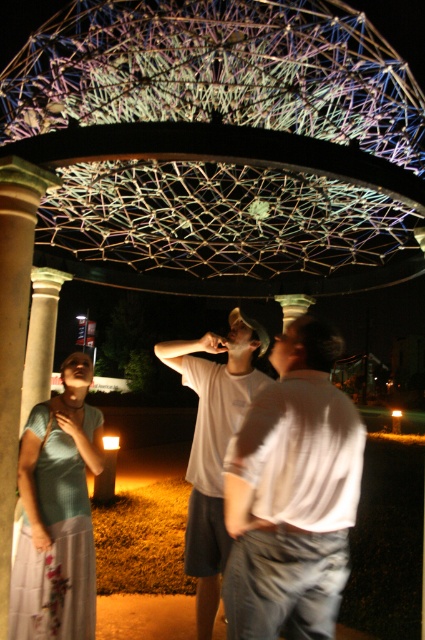
Does white matte t-shirt at center have a lesser height compared to teal fabric blouse at center?

Correct, white matte t-shirt at center is not as tall as teal fabric blouse at center.

Which is more to the right, white matte t-shirt at center or teal fabric blouse at center?

Positioned to the right is white matte t-shirt at center.

Which is in front, point (266, 612) or point (45, 627)?

Point (266, 612) is in front.

Where is `white matte t-shirt at center`? white matte t-shirt at center is located at coordinates (291, 493).

Can you confirm if teal fabric blouse at center is bigger than white cotton t-shirt at center?

No.

How far apart are teal fabric blouse at center and white cotton t-shirt at center?

teal fabric blouse at center is 3.64 feet from white cotton t-shirt at center.

This screenshot has width=425, height=640. What do you see at coordinates (56, 515) in the screenshot?
I see `teal fabric blouse at center` at bounding box center [56, 515].

Where is `teal fabric blouse at center`? teal fabric blouse at center is located at coordinates (56, 515).

Which is more to the left, white matte t-shirt at center or white cotton t-shirt at center?

white cotton t-shirt at center

Does white matte t-shirt at center have a lesser height compared to white cotton t-shirt at center?

Correct, white matte t-shirt at center is not as tall as white cotton t-shirt at center.

Which is in front, point (232, 577) or point (197, 488)?

Point (232, 577)

I want to click on white matte t-shirt at center, so click(x=291, y=493).